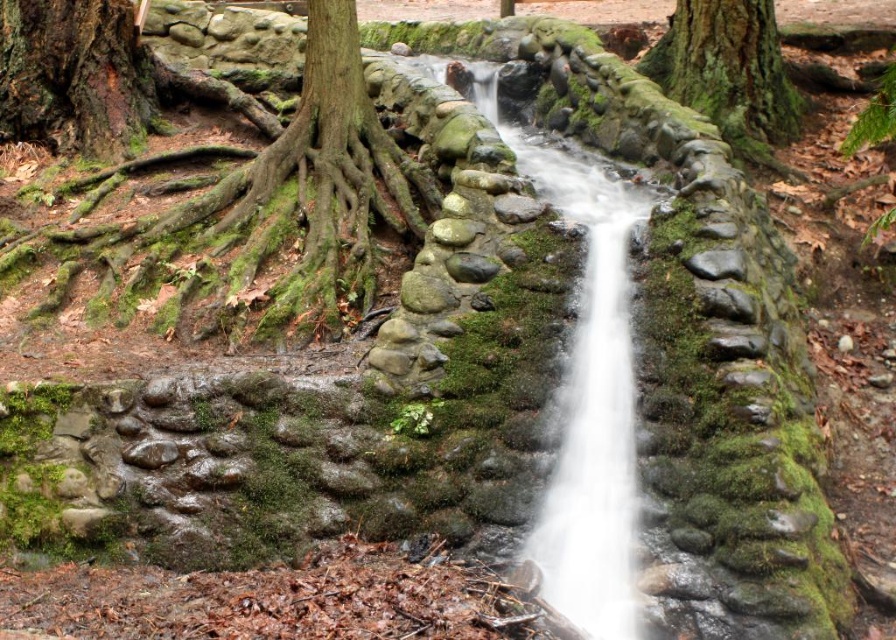
Question: Which of the following is the closest to the observer?

Choices:
 (A) (266, 202)
 (B) (685, 36)

Answer: (A)

Question: Among these objects, which one is farthest from the camera?

Choices:
 (A) green mossy stone stream at center
 (B) green mossy tree trunk at upper right

Answer: (B)

Question: Is green mossy roots at left to the right of green mossy stone stream at center from the viewer's perspective?

Choices:
 (A) yes
 (B) no

Answer: (B)

Question: Which of the following is the closest to the observer?

Choices:
 (A) (701, 90)
 (B) (82, 134)
 (C) (609, 554)

Answer: (C)

Question: Is green mossy roots at left wider than green mossy tree trunk at upper right?

Choices:
 (A) no
 (B) yes

Answer: (B)

Question: Can you confirm if green mossy roots at left is bigger than green mossy tree trunk at upper right?

Choices:
 (A) no
 (B) yes

Answer: (B)